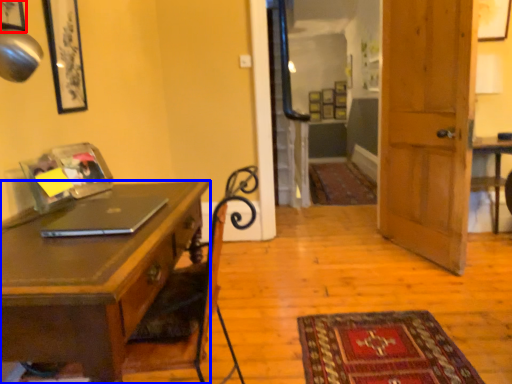
Question: Which of the following is the closest to the observer, picture frame (highlighted by a red box) or desk (highlighted by a blue box)?

Choices:
 (A) picture frame
 (B) desk

Answer: (B)